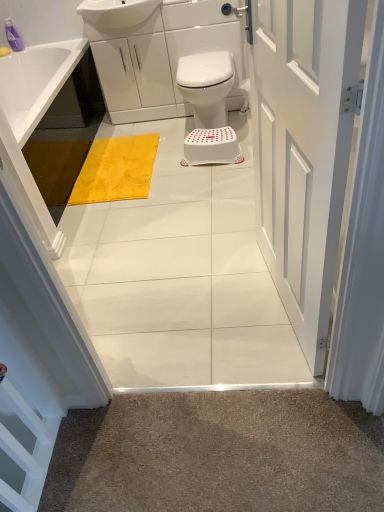
Question: Should I look upward or downward to see translucent purple bottle at upper left?

Choices:
 (A) up
 (B) down

Answer: (A)

Question: From a real-world perspective, is white plastic bidet at center on top of white plastic stool at center?

Choices:
 (A) no
 (B) yes

Answer: (B)

Question: Is white plastic bidet at center oriented away from white plastic stool at center?

Choices:
 (A) no
 (B) yes

Answer: (A)

Question: Is white plastic bidet at center not within white plastic stool at center?

Choices:
 (A) no
 (B) yes

Answer: (B)

Question: Is white plastic bidet at center smaller than white plastic stool at center?

Choices:
 (A) no
 (B) yes

Answer: (A)

Question: Is white plastic bidet at center oriented towards white plastic stool at center?

Choices:
 (A) yes
 (B) no

Answer: (A)

Question: From the image's perspective, is white plastic bidet at center located above white plastic stool at center?

Choices:
 (A) yes
 (B) no

Answer: (A)

Question: Can you confirm if white plastic stool at center is positioned to the right of white glossy sink at upper center?

Choices:
 (A) no
 (B) yes

Answer: (B)

Question: Could you tell me if white plastic stool at center is facing white glossy sink at upper center?

Choices:
 (A) yes
 (B) no

Answer: (B)

Question: Is the depth of white plastic stool at center less than that of white glossy sink at upper center?

Choices:
 (A) yes
 (B) no

Answer: (A)

Question: Can white glossy sink at upper center be found inside white plastic stool at center?

Choices:
 (A) no
 (B) yes

Answer: (A)

Question: Does white plastic stool at center lie behind white glossy sink at upper center?

Choices:
 (A) no
 (B) yes

Answer: (A)

Question: Is white plastic stool at center next to white glossy sink at upper center and touching it?

Choices:
 (A) no
 (B) yes

Answer: (A)

Question: Is white painted wood door at center oriented towards yellow plush bath mat at center?

Choices:
 (A) yes
 (B) no

Answer: (B)